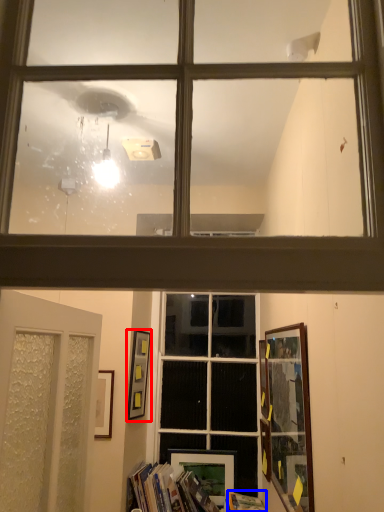
Question: Which object is further to the camera taking this photo, picture frame (highlighted by a red box) or paperback book (highlighted by a blue box)?

Choices:
 (A) picture frame
 (B) paperback book

Answer: (A)